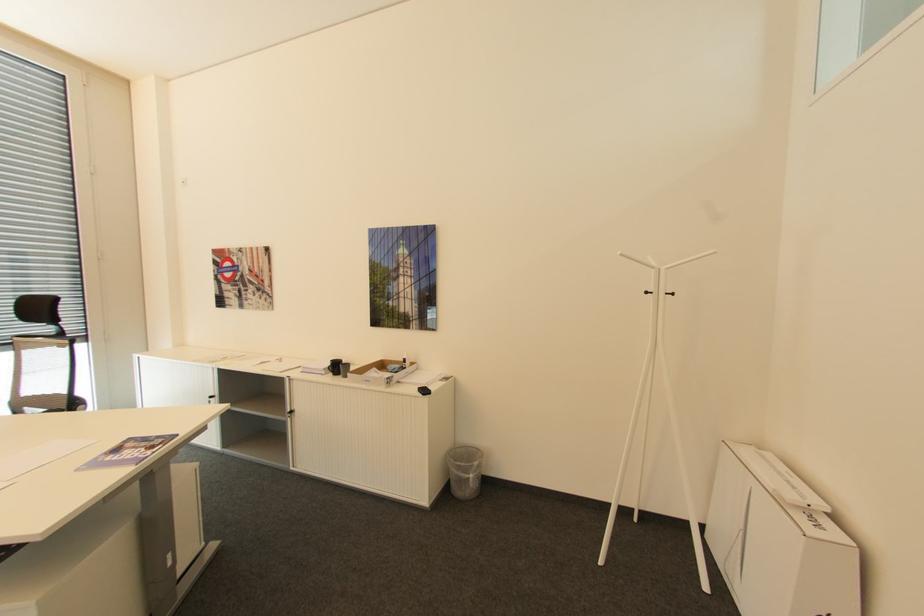
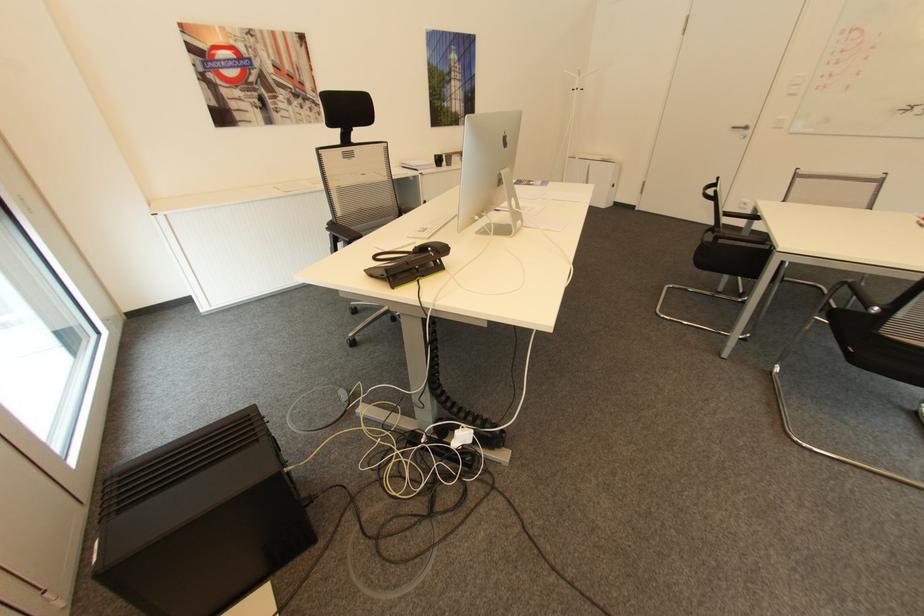
Locate, in the second image, the point that corresponds to (x=658, y=267) in the first image.

(582, 76)